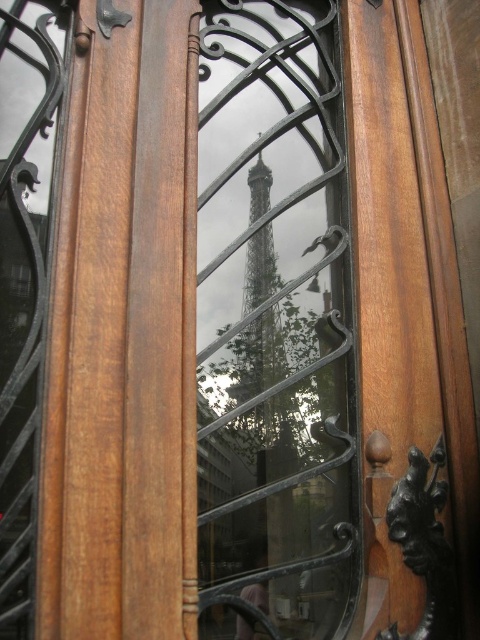
Can you confirm if transparent glass window at center is positioned to the left of metallic silver eiffel tower at center?

Incorrect, transparent glass window at center is not on the left side of metallic silver eiffel tower at center.

Does transparent glass window at center have a lesser height compared to metallic silver eiffel tower at center?

No, transparent glass window at center is not shorter than metallic silver eiffel tower at center.

At what (x,y) coordinates should I click in order to perform the action: click on transparent glass window at center. Please return your answer as a coordinate pair (x, y). This screenshot has width=480, height=640. Looking at the image, I should click on (274, 324).

Locate an element on the screen. Image resolution: width=480 pixels, height=640 pixels. transparent glass window at center is located at coordinates (274, 324).